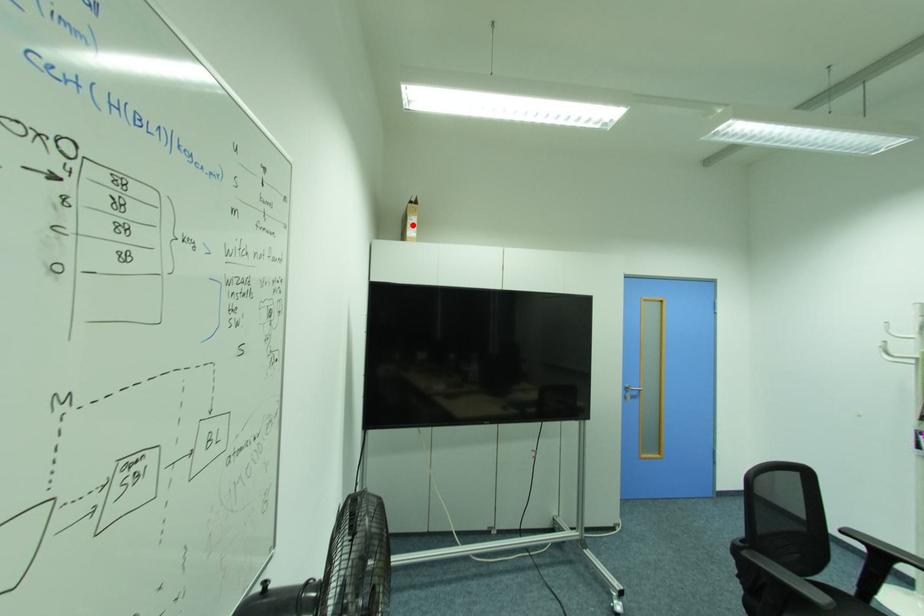
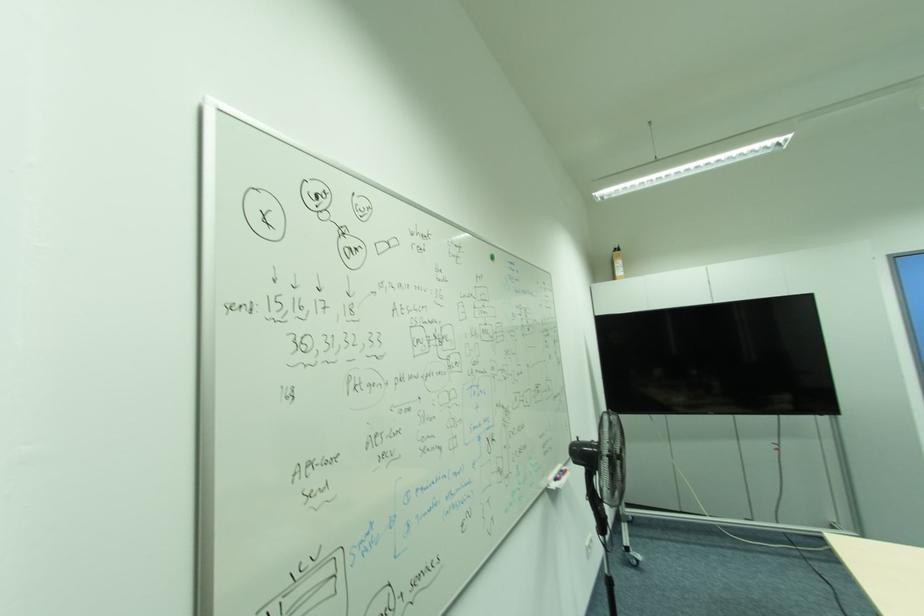
Where in the second image is the point corresponding to the highlighted location from the first image?

(621, 269)